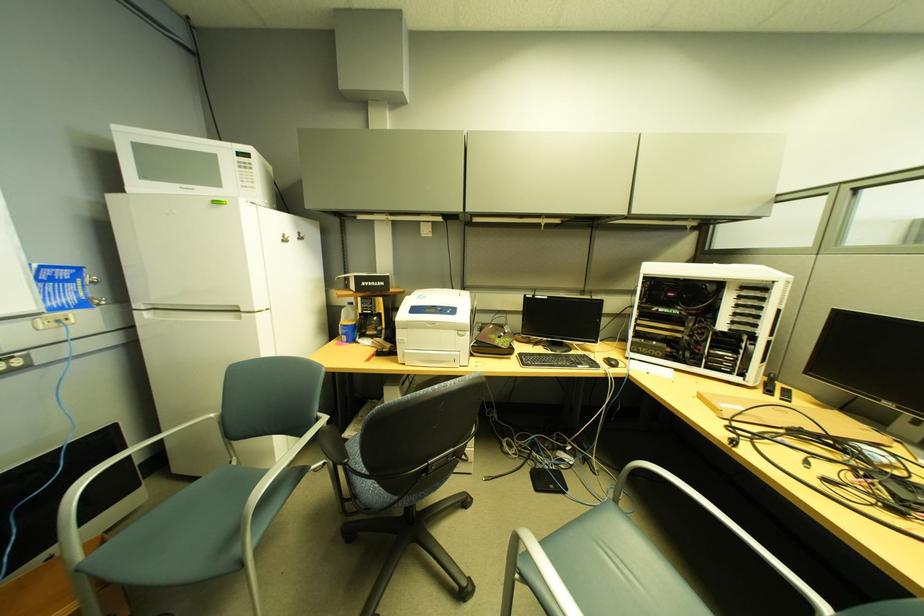
Where would you lift the white printer lid? Please return your answer as a coordinate pair (x, y).

(190, 166)